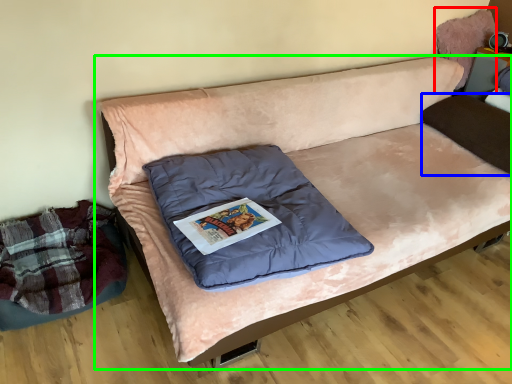
Question: Which is farther away from bean bag chair (highlighted by a red box)? pillow (highlighted by a blue box) or studio couch (highlighted by a green box)?

Choices:
 (A) pillow
 (B) studio couch

Answer: (B)